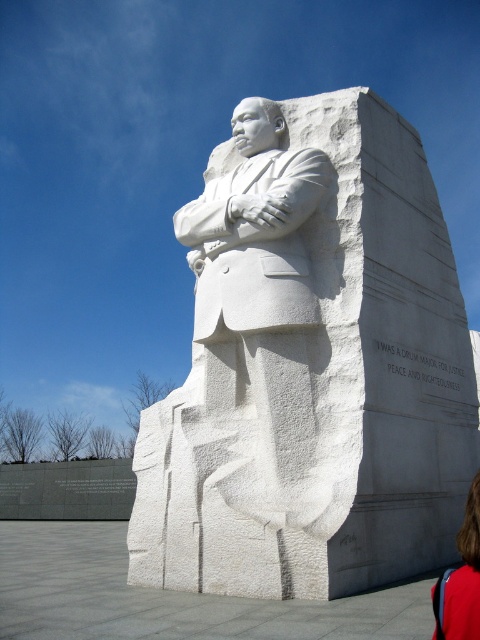
Question: Can you confirm if white marble statue at center is positioned to the right of blonde hair at lower right?

Choices:
 (A) yes
 (B) no

Answer: (B)

Question: Among these objects, which one is farthest from the camera?

Choices:
 (A) white marble statue at center
 (B) blonde hair at lower right

Answer: (A)

Question: Considering the relative positions of white marble statue at center and blonde hair at lower right in the image provided, where is white marble statue at center located with respect to blonde hair at lower right?

Choices:
 (A) above
 (B) below

Answer: (A)

Question: Which point is farther to the camera?

Choices:
 (A) white marble statue at center
 (B) blonde hair at lower right

Answer: (A)

Question: Where is white marble statue at center located in relation to blonde hair at lower right in the image?

Choices:
 (A) left
 (B) right

Answer: (A)